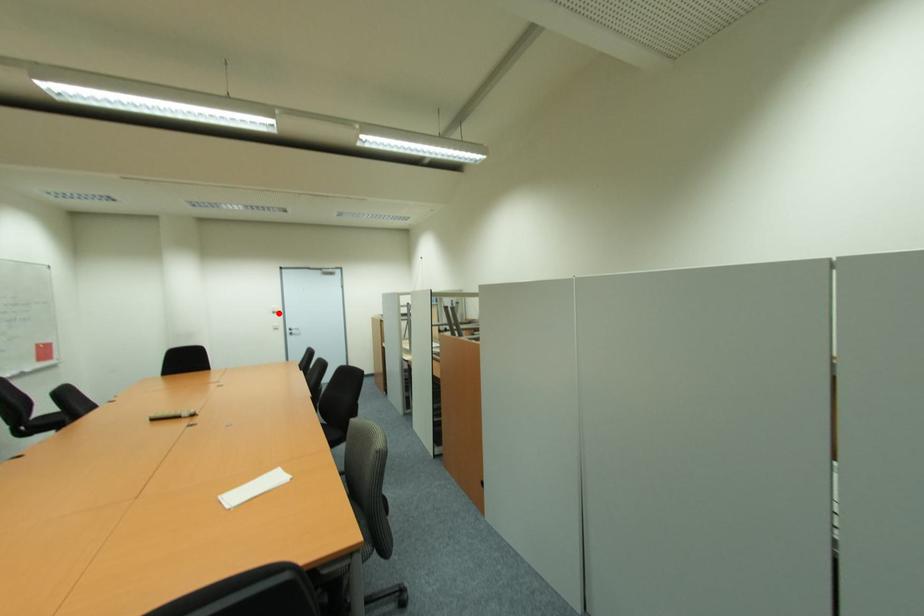
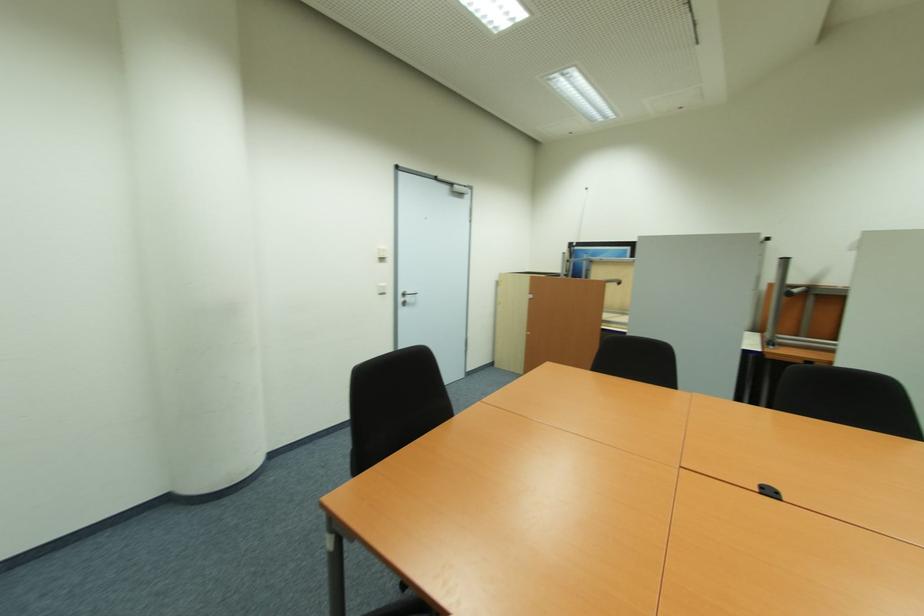
Where in the second image is the point corresponding to the highlighted location from the first image?

(385, 260)